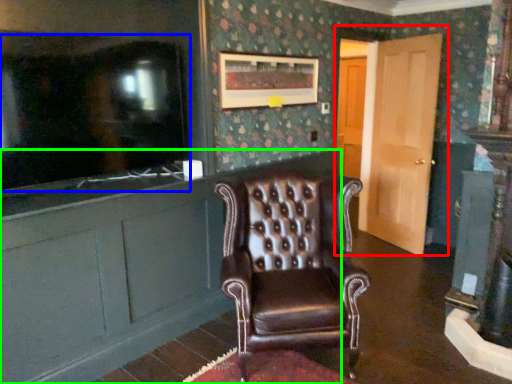
Question: Considering the real-world distances, which object is closest to door (highlighted by a red box)? tv show (highlighted by a blue box) or cabinetry (highlighted by a green box).

Choices:
 (A) tv show
 (B) cabinetry

Answer: (B)